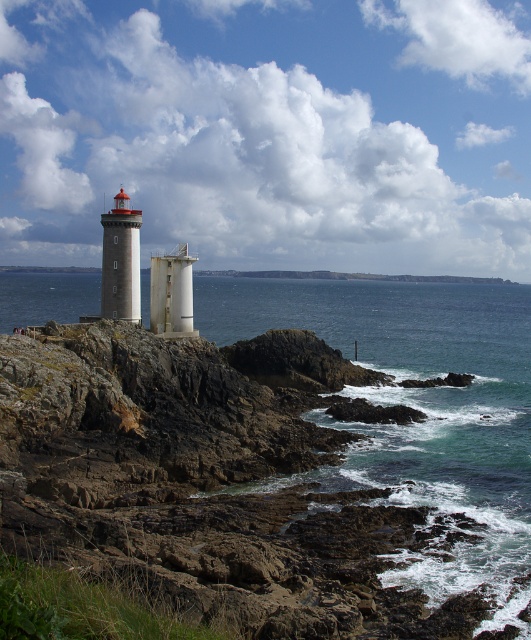
Question: Among these points, which one is nearest to the camera?

Choices:
 (A) (173, 332)
 (B) (107, 298)

Answer: (B)

Question: Among these objects, which one is nearest to the camera?

Choices:
 (A) white matte tower at center
 (B) white painted metal lighthouse at left
 (C) blue-green water at center

Answer: (C)

Question: Is white painted metal lighthouse at left closer to the viewer compared to white matte tower at center?

Choices:
 (A) no
 (B) yes

Answer: (B)

Question: Which point is closer to the camera?

Choices:
 (A) white matte tower at center
 (B) white painted metal lighthouse at left

Answer: (B)

Question: Can you confirm if blue-green water at center is wider than white matte tower at center?

Choices:
 (A) yes
 (B) no

Answer: (A)

Question: Can you confirm if blue-green water at center is positioned to the left of white painted metal lighthouse at left?

Choices:
 (A) yes
 (B) no

Answer: (B)